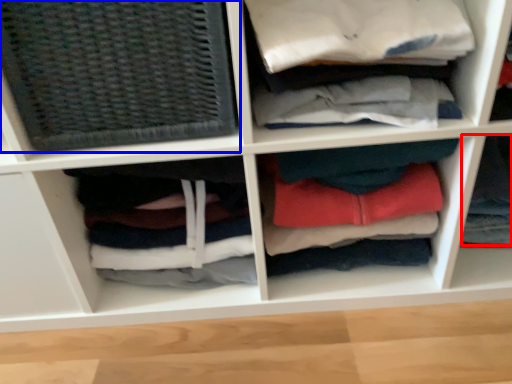
Question: Which of the following is the closest to the observer, clothing (highlighted by a red box) or basket (highlighted by a blue box)?

Choices:
 (A) clothing
 (B) basket

Answer: (B)